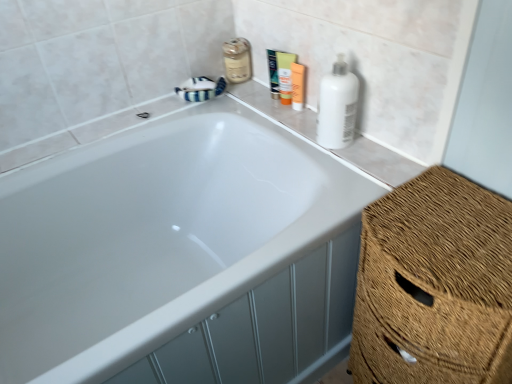
This screenshot has width=512, height=384. Identify the location of vacant space in between orange matte lotion at upper center, which is the 3th toiletry in left-to-right order, and white matte bottle at upper right. (307, 115).